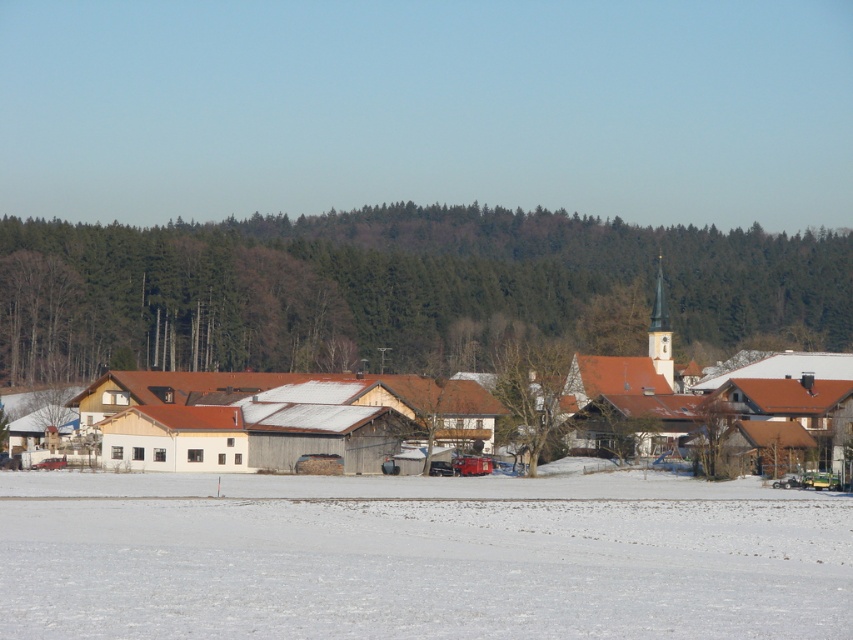
Which of these two, white powdery snow at lower center or brown wooden tree at center, stands shorter?

Standing shorter between the two is white powdery snow at lower center.

Is white powdery snow at lower center positioned before brown wooden tree at center?

Yes, white powdery snow at lower center is closer to the viewer.

Identify the location of white powdery snow at lower center. (419, 556).

The height and width of the screenshot is (640, 853). In order to click on white powdery snow at lower center in this screenshot , I will do `click(419, 556)`.

Is point (62, 544) closer to camera compared to point (494, 435)?

Yes, it is in front of point (494, 435).

Which of these two, white powdery snow at lower center or white wooden houses at center, stands taller?

With more height is white wooden houses at center.

Find the location of `white powdery snow at lower center`. white powdery snow at lower center is located at coordinates (419, 556).

Is green leafy trees at center taller than white wooden houses at center?

Indeed, green leafy trees at center has a greater height compared to white wooden houses at center.

I want to click on green leafy trees at center, so click(x=401, y=291).

Locate an element on the screen. The height and width of the screenshot is (640, 853). green leafy trees at center is located at coordinates (401, 291).